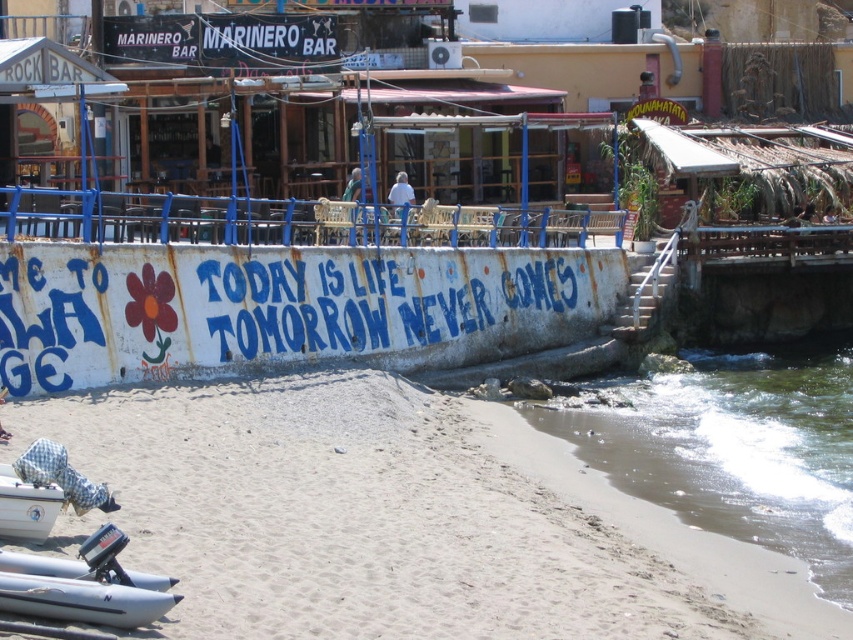
Can you confirm if clear water at lower right is positioned below white matte boat at lower left?

Correct, clear water at lower right is located below white matte boat at lower left.

Between point (807, 456) and point (16, 497), which one is positioned behind?

Point (807, 456)

Does point (846, 499) come farther from viewer compared to point (6, 467)?

Yes, it is.

Find the location of a particular element. Image resolution: width=853 pixels, height=640 pixels. clear water at lower right is located at coordinates (732, 448).

What do you see at coordinates (352, 516) in the screenshot?
I see `white sandy beach at lower left` at bounding box center [352, 516].

Who is positioned more to the right, white sandy beach at lower left or clear water at lower right?

clear water at lower right is more to the right.

You are a GUI agent. You are given a task and a screenshot of the screen. Output one action in this format:
    pyautogui.click(x=<x>, y=<y>)
    Task: Click on the white sandy beach at lower left
    The image size is (853, 640).
    Given the screenshot: What is the action you would take?
    pyautogui.click(x=352, y=516)

Who is lower down, clear water at lower right or white rubber boat at lower left?

white rubber boat at lower left is below.

Between point (692, 515) and point (38, 560), which one is positioned in front?

Point (38, 560) is more forward.

At what (x,y) coordinates should I click in order to perform the action: click on clear water at lower right. Please return your answer as a coordinate pair (x, y). Looking at the image, I should click on (732, 448).